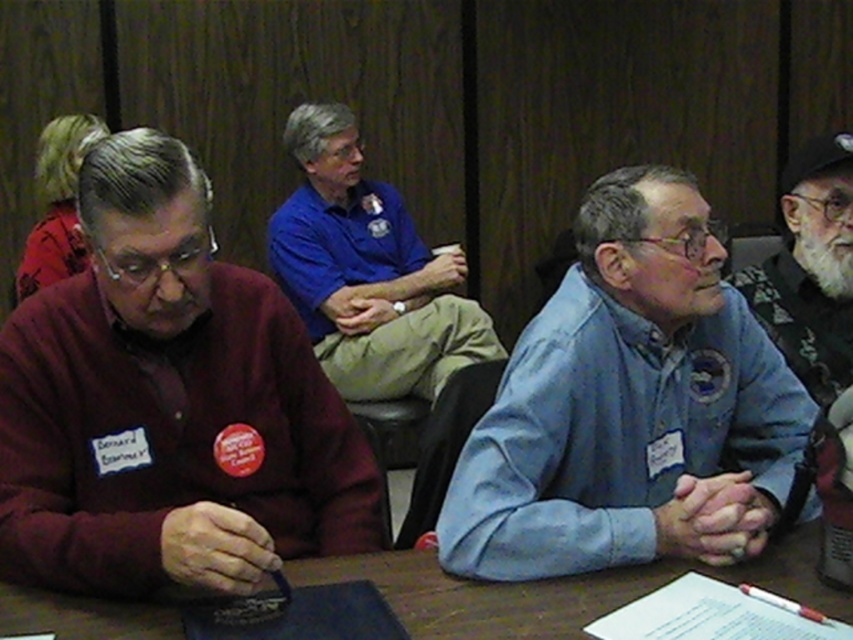
Can you confirm if maroon sweater at left is shorter than white beard at upper right?

Incorrect, maroon sweater at left's height does not fall short of white beard at upper right's.

Can you confirm if maroon sweater at left is thinner than white beard at upper right?

In fact, maroon sweater at left might be wider than white beard at upper right.

Which is behind, point (16, 474) or point (785, 349)?

Point (785, 349)

This screenshot has height=640, width=853. I want to click on maroon sweater at left, so click(167, 404).

Between blue cotton shirt at center and white beard at upper right, which one has less height?

Standing shorter between the two is white beard at upper right.

This screenshot has height=640, width=853. What do you see at coordinates (368, 273) in the screenshot?
I see `blue cotton shirt at center` at bounding box center [368, 273].

Locate an element on the screen. This screenshot has height=640, width=853. blue cotton shirt at center is located at coordinates (368, 273).

Does maroon sweater at left have a lesser width compared to blue denim shirt at center?

Indeed, maroon sweater at left has a lesser width compared to blue denim shirt at center.

Does maroon sweater at left appear on the left side of blue denim shirt at center?

Indeed, maroon sweater at left is positioned on the left side of blue denim shirt at center.

What do you see at coordinates (167, 404) in the screenshot? The image size is (853, 640). I see `maroon sweater at left` at bounding box center [167, 404].

The height and width of the screenshot is (640, 853). I want to click on maroon sweater at left, so click(167, 404).